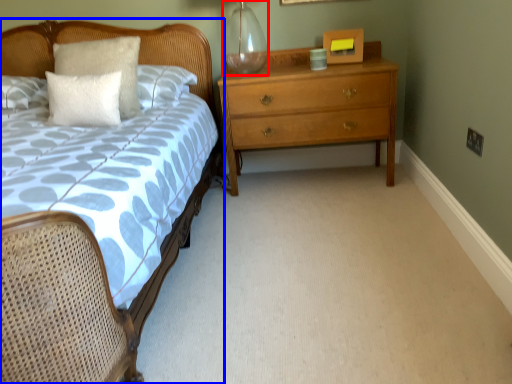
Question: Which of the following is the closest to the observer, glass vase (highlighted by a red box) or bed (highlighted by a blue box)?

Choices:
 (A) glass vase
 (B) bed

Answer: (B)